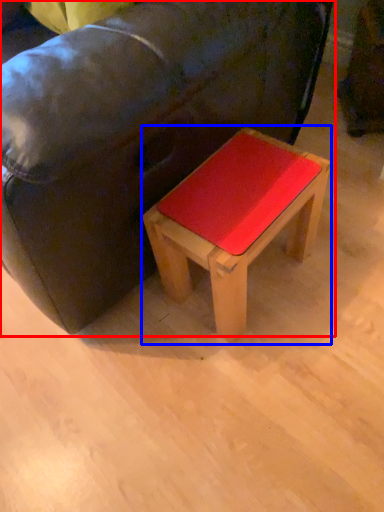
Question: Which object appears closest to the camera in this image, studio couch (highlighted by a red box) or stool (highlighted by a blue box)?

Choices:
 (A) studio couch
 (B) stool

Answer: (A)